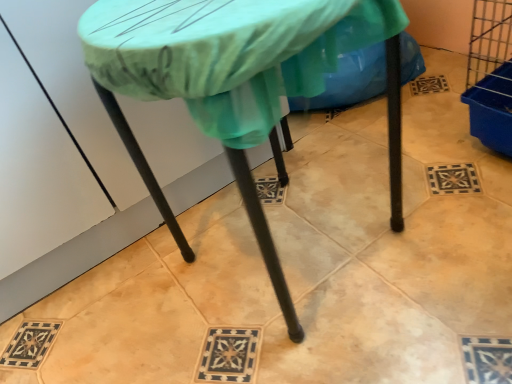
Find the location of `matte green tablecloth at center`. matte green tablecloth at center is located at coordinates (238, 76).

Image resolution: width=512 pixels, height=384 pixels. Describe the element at coordinates (238, 76) in the screenshot. I see `matte green tablecloth at center` at that location.

Find the location of `green fabric at center`. green fabric at center is located at coordinates (293, 76).

The height and width of the screenshot is (384, 512). Describe the element at coordinates (293, 76) in the screenshot. I see `green fabric at center` at that location.

The height and width of the screenshot is (384, 512). Identify the location of matte green tablecloth at center. (238, 76).

Considering the relative positions of matte green tablecloth at center and green fabric at center in the image provided, is matte green tablecloth at center to the left or to the right of green fabric at center?

matte green tablecloth at center is positioned on green fabric at center's left side.

Is the depth of matte green tablecloth at center greater than that of green fabric at center?

No, it is not.

Which is closer, (114, 30) or (227, 93)?

Point (114, 30).

From the image's perspective, would you say matte green tablecloth at center is positioned over green fabric at center?

No, from the image's perspective, matte green tablecloth at center is not on top of green fabric at center.

From a real-world perspective, is matte green tablecloth at center physically located above or below green fabric at center?

In terms of real-world spatial position, matte green tablecloth at center is above green fabric at center.

Is matte green tablecloth at center thinner than green fabric at center?

In fact, matte green tablecloth at center might be wider than green fabric at center.

Between matte green tablecloth at center and green fabric at center, which one has less height?

With less height is green fabric at center.

Between matte green tablecloth at center and green fabric at center, which one has larger size?

matte green tablecloth at center.

Is matte green tablecloth at center surrounding green fabric at center?

→ Definitely not — green fabric at center is not inside matte green tablecloth at center.

Is the surface of matte green tablecloth at center in direct contact with green fabric at center?

Yes, matte green tablecloth at center is next to green fabric at center.

Is matte green tablecloth at center aimed at green fabric at center?

No, matte green tablecloth at center is not aimed at green fabric at center.

The width and height of the screenshot is (512, 384). I want to click on table below the green fabric at center (from the image's perspective), so click(x=238, y=76).

Considering the relative positions of green fabric at center and matte green tablecloth at center in the image provided, is green fabric at center to the right of matte green tablecloth at center from the viewer's perspective?

Indeed, green fabric at center is positioned on the right side of matte green tablecloth at center.

Does green fabric at center come behind matte green tablecloth at center?

That is True.

Which is farther from the camera, (209, 114) or (393, 37)?

The point (393, 37) is farther.

From the image's perspective, would you say green fabric at center is shown under matte green tablecloth at center?

No, from the image's perspective, green fabric at center is not below matte green tablecloth at center.

From a real-world perspective, relative to matte green tablecloth at center, is green fabric at center vertically above or below?

Clearly, from a real-world perspective, green fabric at center is below matte green tablecloth at center.

Is green fabric at center wider than matte green tablecloth at center?

Incorrect, the width of green fabric at center does not surpass that of matte green tablecloth at center.

Is green fabric at center shorter than matte green tablecloth at center?

Yes.

Considering the relative sizes of green fabric at center and matte green tablecloth at center in the image provided, is green fabric at center smaller than matte green tablecloth at center?

Yes.

Is matte green tablecloth at center located within green fabric at center?

That's incorrect, matte green tablecloth at center is not inside green fabric at center.

Is there a large distance between green fabric at center and matte green tablecloth at center?

That's not correct — green fabric at center is a little close to matte green tablecloth at center.

Based on the photo, is matte green tablecloth at center at the back of green fabric at center?

That's not correct — green fabric at center is not looking away from matte green tablecloth at center.

Where is `fabric behind the matte green tablecloth at center`? This screenshot has width=512, height=384. fabric behind the matte green tablecloth at center is located at coordinates coord(293,76).

Locate an element on the screen. The image size is (512, 384). table below the green fabric at center (from the image's perspective) is located at coordinates [238, 76].

Where is `table in front of the green fabric at center`? table in front of the green fabric at center is located at coordinates (238, 76).